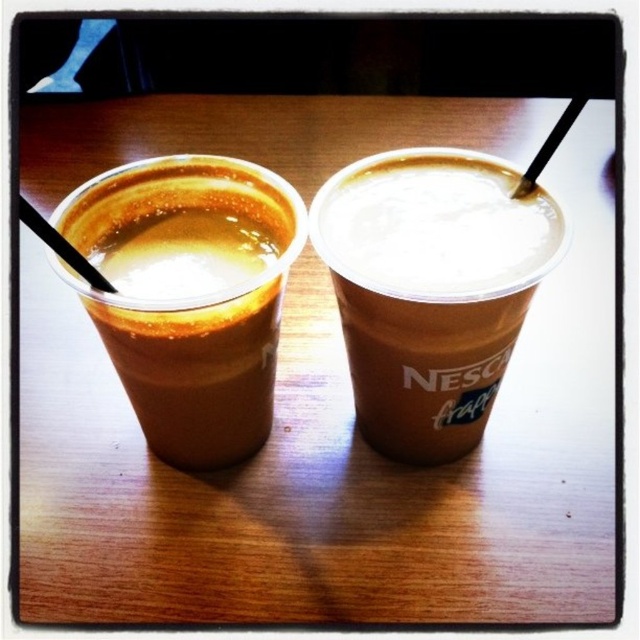
You are a delivery person who needs to pick up the black plastic straw at left. Based on the coordinates provided, can you determine if the straw is positioned closer to the edge of the table or near the center?

The 2D location of black plastic straw at left is at point (61, 246), which is closer to the edge of the table since the coordinates are near the lower left corner of the image frame.

You are a customer at a coffee shop and want to pick up your drink. You see two cups on the table. The first cup is at point (451,252) and the second is at point (83,266). Which cup is closer to you?

The cup at point (451,252) is closer to you because it is further to the viewer than point (83,266).